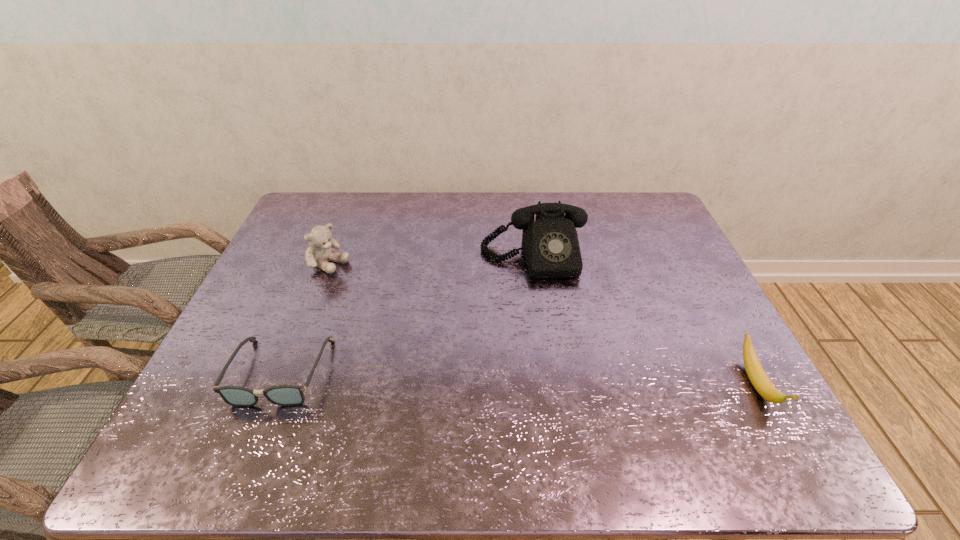
Image resolution: width=960 pixels, height=540 pixels. I want to click on free space at the left edge, so click(282, 312).

You are a GUI agent. You are given a task and a screenshot of the screen. Output one action in this format:
    pyautogui.click(x=<x>, y=<y>)
    Task: Click on the vacant space at the right edge of the desktop
    This screenshot has width=960, height=540.
    Given the screenshot: What is the action you would take?
    pyautogui.click(x=709, y=319)

This screenshot has width=960, height=540. Identify the location of vacant space at the far right corner of the desktop. (654, 211).

I want to click on free spot between the teddy bear and the second shortest object, so pos(542,325).

Locate an element on the screen. vacant area between the rightmost object and the teddy bear is located at coordinates (542, 325).

Where is `vacant area that lies between the shortest object and the second shortest object`? This screenshot has height=540, width=960. vacant area that lies between the shortest object and the second shortest object is located at coordinates (518, 378).

Find the location of a particular element. Image resolution: width=960 pixels, height=540 pixels. empty space between the second shortest object and the shortest object is located at coordinates (518, 378).

At what (x,y) coordinates should I click in order to perform the action: click on free point between the teddy bear and the second object from right to left. Please return your answer as a coordinate pair (x, y). Looking at the image, I should click on (431, 261).

This screenshot has height=540, width=960. Find the location of `empty space that is in between the shortest object and the teddy bear`. empty space that is in between the shortest object and the teddy bear is located at coordinates (304, 318).

I want to click on unoccupied area between the banana and the telephone, so click(x=645, y=321).